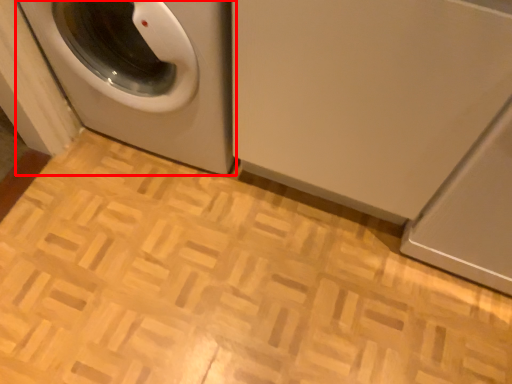
Question: Observing the image, what is the correct spatial positioning of washing machine (annotated by the red box) in reference to washing machine?

Choices:
 (A) left
 (B) right

Answer: (A)